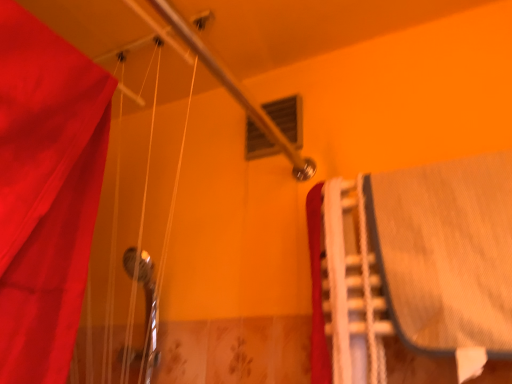
Question: Is white plastic stairs at right far away from denim bed at right?

Choices:
 (A) no
 (B) yes

Answer: (A)

Question: From the image's perspective, does white plastic stairs at right appear lower than denim bed at right?

Choices:
 (A) yes
 (B) no

Answer: (A)

Question: From the image's perspective, is white plastic stairs at right on denim bed at right?

Choices:
 (A) no
 (B) yes

Answer: (A)

Question: Can you confirm if white plastic stairs at right is shorter than denim bed at right?

Choices:
 (A) yes
 (B) no

Answer: (B)

Question: Is white plastic stairs at right thinner than denim bed at right?

Choices:
 (A) no
 (B) yes

Answer: (B)

Question: Is matte plastic window at upper center inside or outside of white plastic stairs at right?

Choices:
 (A) outside
 (B) inside

Answer: (A)

Question: In terms of width, does matte plastic window at upper center look wider or thinner when compared to white plastic stairs at right?

Choices:
 (A) thin
 (B) wide

Answer: (A)

Question: Is matte plastic window at upper center in front of or behind white plastic stairs at right in the image?

Choices:
 (A) front
 (B) behind

Answer: (B)

Question: From a real-world perspective, relative to white plastic stairs at right, is matte plastic window at upper center vertically above or below?

Choices:
 (A) below
 (B) above

Answer: (B)

Question: Is white plastic stairs at right in front of or behind denim bed at right in the image?

Choices:
 (A) behind
 (B) front

Answer: (A)

Question: Looking at their shapes, would you say white plastic stairs at right is wider or thinner than denim bed at right?

Choices:
 (A) thin
 (B) wide

Answer: (A)

Question: Is white plastic stairs at right inside the boundaries of denim bed at right, or outside?

Choices:
 (A) inside
 (B) outside

Answer: (A)

Question: In terms of height, does white plastic stairs at right look taller or shorter compared to denim bed at right?

Choices:
 (A) tall
 (B) short

Answer: (A)

Question: Is denim bed at right taller or shorter than matte plastic window at upper center?

Choices:
 (A) short
 (B) tall

Answer: (B)

Question: From the image's perspective, is denim bed at right positioned above or below matte plastic window at upper center?

Choices:
 (A) above
 (B) below

Answer: (B)